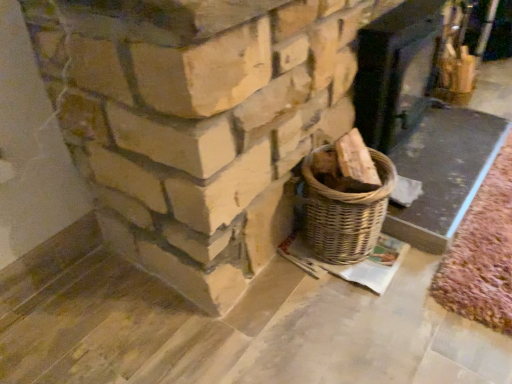
Question: Can natural stone fireplace at upper left, which ranks as the 1th fireplace in left-to-right order, be found inside smooth dark wood fireplace at upper right, acting as the first fireplace starting from the right?

Choices:
 (A) no
 (B) yes

Answer: (A)

Question: Considering the relative positions of smooth dark wood fireplace at upper right, which is the 2th fireplace in left-to-right order, and natural stone fireplace at upper left, which ranks as the 1th fireplace in left-to-right order, in the image provided, is smooth dark wood fireplace at upper right, which is the 2th fireplace in left-to-right order, behind natural stone fireplace at upper left, which ranks as the 1th fireplace in left-to-right order,?

Choices:
 (A) yes
 (B) no

Answer: (A)

Question: Considering the relative sizes of smooth dark wood fireplace at upper right, acting as the first fireplace starting from the right, and natural stone fireplace at upper left, acting as the 2th fireplace starting from the right, in the image provided, is smooth dark wood fireplace at upper right, acting as the first fireplace starting from the right, taller than natural stone fireplace at upper left, acting as the 2th fireplace starting from the right,?

Choices:
 (A) no
 (B) yes

Answer: (A)

Question: Does smooth dark wood fireplace at upper right, which is the 2th fireplace in left-to-right order, have a larger size compared to natural stone fireplace at upper left, which ranks as the 1th fireplace in left-to-right order?

Choices:
 (A) no
 (B) yes

Answer: (B)

Question: Can you confirm if smooth dark wood fireplace at upper right, which is the 2th fireplace in left-to-right order, is wider than natural stone fireplace at upper left, which ranks as the 1th fireplace in left-to-right order?

Choices:
 (A) no
 (B) yes

Answer: (B)

Question: From a real-world perspective, does smooth dark wood fireplace at upper right, acting as the first fireplace starting from the right, sit lower than natural stone fireplace at upper left, which ranks as the 1th fireplace in left-to-right order?

Choices:
 (A) yes
 (B) no

Answer: (A)

Question: Does natural stone fireplace at upper left, acting as the 2th fireplace starting from the right, lie in front of smooth dark wood fireplace at upper right, which is the 2th fireplace in left-to-right order?

Choices:
 (A) no
 (B) yes

Answer: (B)

Question: From a real-world perspective, is natural stone fireplace at upper left, which ranks as the 1th fireplace in left-to-right order, located higher than smooth dark wood fireplace at upper right, acting as the first fireplace starting from the right?

Choices:
 (A) yes
 (B) no

Answer: (A)

Question: Is natural stone fireplace at upper left, acting as the 2th fireplace starting from the right, positioned far away from smooth dark wood fireplace at upper right, which is the 2th fireplace in left-to-right order?

Choices:
 (A) yes
 (B) no

Answer: (B)

Question: Considering the relative sizes of natural stone fireplace at upper left, which ranks as the 1th fireplace in left-to-right order, and smooth dark wood fireplace at upper right, acting as the first fireplace starting from the right, in the image provided, is natural stone fireplace at upper left, which ranks as the 1th fireplace in left-to-right order, smaller than smooth dark wood fireplace at upper right, acting as the first fireplace starting from the right,?

Choices:
 (A) no
 (B) yes

Answer: (B)

Question: Is natural stone fireplace at upper left, acting as the 2th fireplace starting from the right, further to the viewer compared to smooth dark wood fireplace at upper right, acting as the first fireplace starting from the right?

Choices:
 (A) no
 (B) yes

Answer: (A)

Question: From a real-world perspective, is natural stone fireplace at upper left, acting as the 2th fireplace starting from the right, below smooth dark wood fireplace at upper right, which is the 2th fireplace in left-to-right order?

Choices:
 (A) yes
 (B) no

Answer: (B)

Question: Would you say smooth dark wood fireplace at upper right, which is the 2th fireplace in left-to-right order, is to the left or to the right of natural stone fireplace at upper left, acting as the 2th fireplace starting from the right, in the picture?

Choices:
 (A) right
 (B) left

Answer: (A)